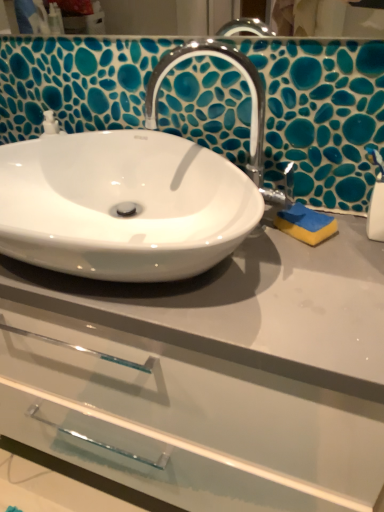
Image resolution: width=384 pixels, height=512 pixels. In order to click on vacant space in between white glossy sink at center and yellow sponge at right in this screenshot , I will do `click(283, 274)`.